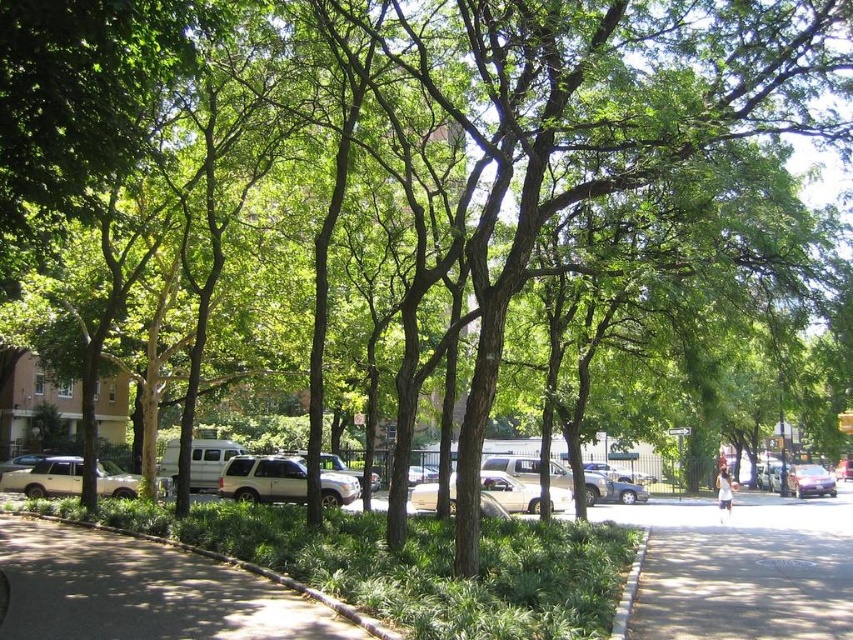
Does gray concrete curb at lower right lie behind purple glossy sedan at center-right?

That is False.

Does gray concrete curb at lower right have a greater width compared to purple glossy sedan at center-right?

Incorrect, gray concrete curb at lower right's width does not surpass purple glossy sedan at center-right's.

Which is in front, point (622, 636) or point (827, 486)?

Point (622, 636) is in front.

What are the coordinates of `gray concrete curb at lower right` in the screenshot? It's located at (630, 589).

Does green grass at lower left have a lesser width compared to metallic silver car at center?

Incorrect, green grass at lower left's width is not less than metallic silver car at center's.

Does green grass at lower left come behind metallic silver car at center?

No.

Does point (16, 584) come in front of point (535, 504)?

That is True.

Find the location of a particular element. This screenshot has width=853, height=640. green grass at lower left is located at coordinates (161, 589).

Is metallic silver car at center shorter than purple glossy sedan at center-right?

Yes, metallic silver car at center is shorter than purple glossy sedan at center-right.

Is metallic silver car at center closer to the viewer compared to purple glossy sedan at center-right?

Yes.

Locate an element on the screen. This screenshot has height=640, width=853. metallic silver car at center is located at coordinates (509, 492).